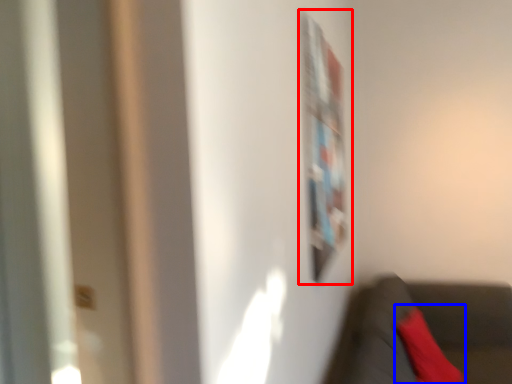
Question: Which object is further to the camera taking this photo, bulletin board (highlighted by a red box) or pillow (highlighted by a blue box)?

Choices:
 (A) bulletin board
 (B) pillow

Answer: (B)